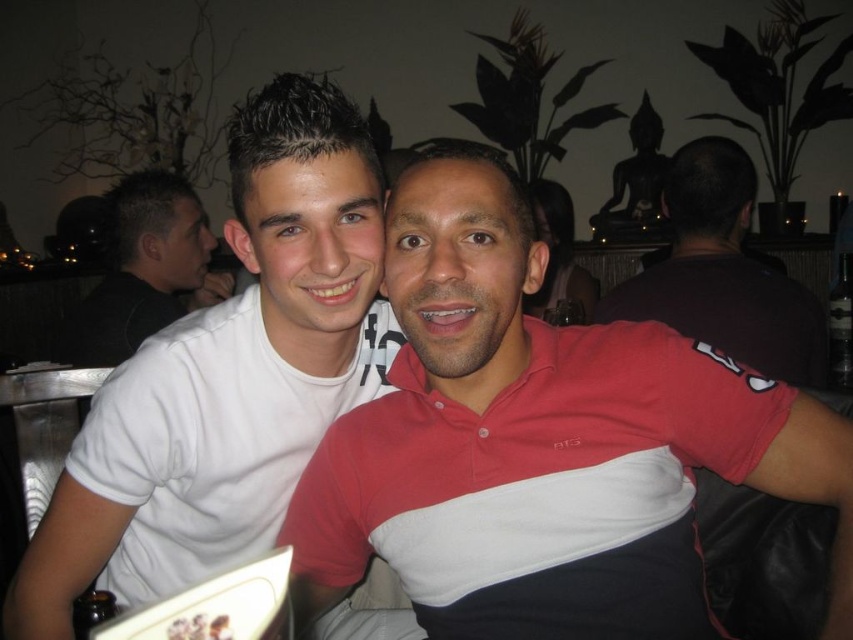
Question: Can you confirm if white matte t-shirt at left is wider than white matte shirt at left?

Choices:
 (A) no
 (B) yes

Answer: (B)

Question: Can you confirm if white matte t-shirt at left is positioned above dark brown shirt at upper right?

Choices:
 (A) yes
 (B) no

Answer: (B)

Question: Which point appears farthest from the camera in this image?

Choices:
 (A) (770, 346)
 (B) (120, 566)
 (C) (171, 227)
 (D) (851, 531)

Answer: (C)

Question: Does matte red and white polo shirt at center have a greater width compared to white matte shirt at left?

Choices:
 (A) yes
 (B) no

Answer: (A)

Question: Which of the following is the farthest from the observer?

Choices:
 (A) matte red and white polo shirt at center
 (B) white matte t-shirt at left
 (C) dark brown shirt at upper right

Answer: (C)

Question: Among these objects, which one is nearest to the camera?

Choices:
 (A) matte red and white polo shirt at center
 (B) white matte shirt at left

Answer: (A)